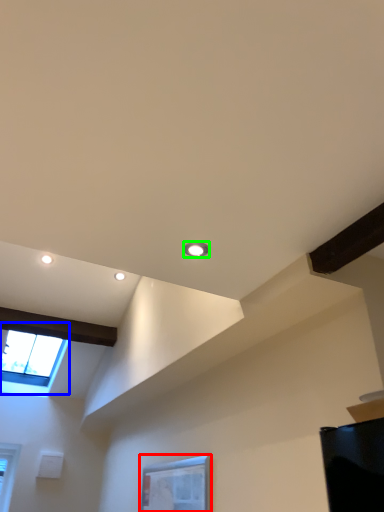
Question: Which object is positioned closest to window (highlighted by a red box)? Select from window (highlighted by a blue box) and droplight (highlighted by a green box).

Choices:
 (A) window
 (B) droplight

Answer: (B)